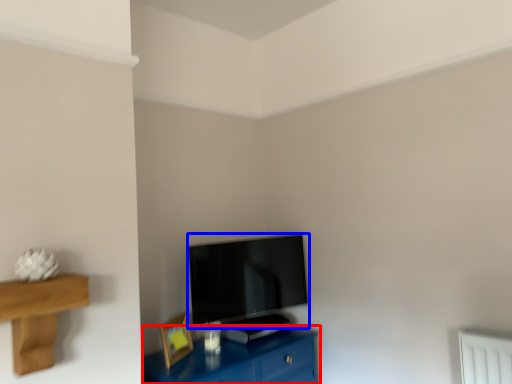
Question: Which object appears farthest to the camera in this image, table (highlighted by a red box) or television (highlighted by a blue box)?

Choices:
 (A) table
 (B) television

Answer: (B)